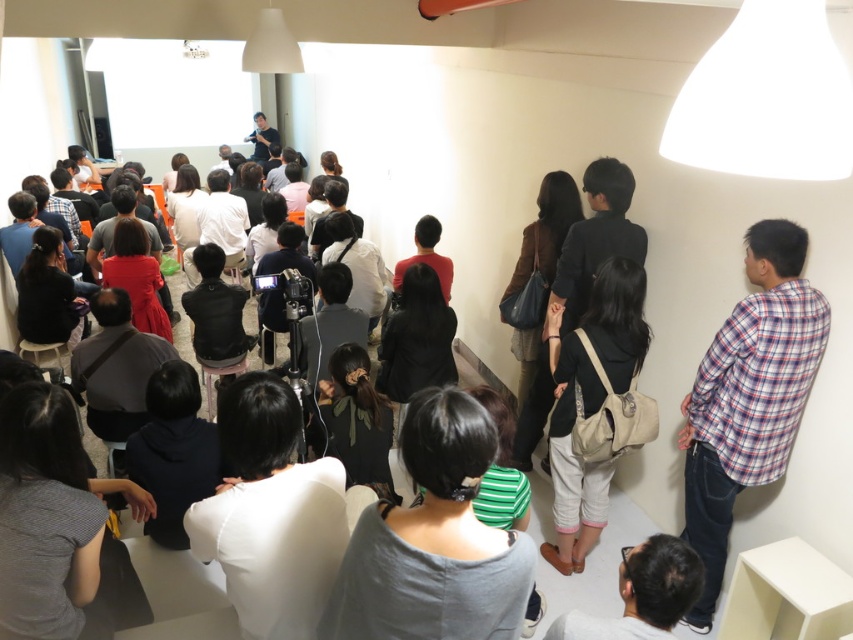
Is gray matte shirt at center positioned before black matte bag at center?

Yes.

Is gray matte shirt at center to the left of black matte bag at center from the viewer's perspective?

Indeed, gray matte shirt at center is positioned on the left side of black matte bag at center.

Does point (459, 458) lie in front of point (582, 477)?

Yes, it is.

Where is `gray matte shirt at center`? gray matte shirt at center is located at coordinates (434, 541).

Describe the element at coordinates (434, 541) in the screenshot. I see `gray matte shirt at center` at that location.

Is point (387, 531) in front of point (764, 438)?

Yes, it is.

Locate an element on the screen. The width and height of the screenshot is (853, 640). gray matte shirt at center is located at coordinates (434, 541).

Can you confirm if plaid fabric shirt at right is positioned to the left of black matte bag at center?

In fact, plaid fabric shirt at right is to the right of black matte bag at center.

Does plaid fabric shirt at right lie in front of black matte bag at center?

Yes, it is in front of black matte bag at center.

Who is more distant from viewer, [703,529] or [555,417]?

Point [555,417]

Where is `plaid fabric shirt at right`? This screenshot has width=853, height=640. plaid fabric shirt at right is located at coordinates (747, 396).